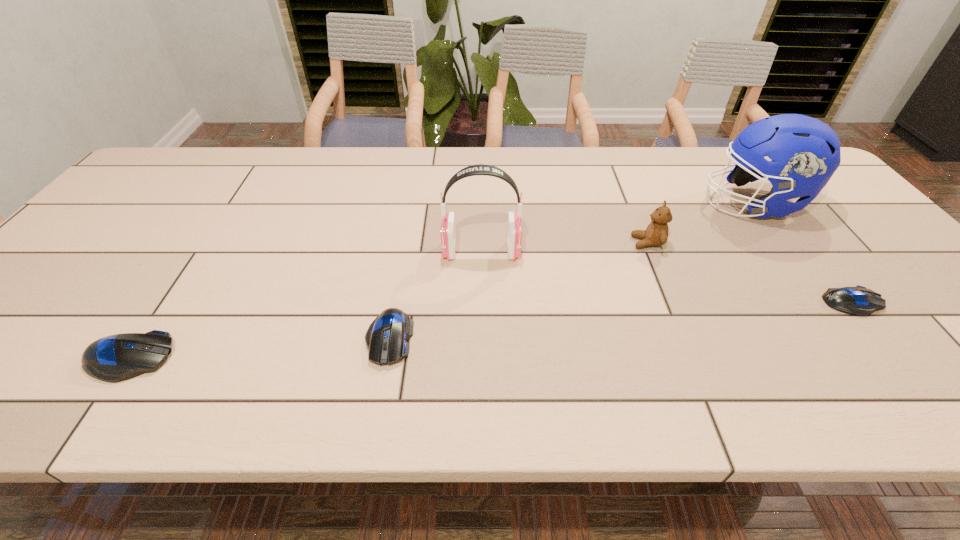
Identify which computer mouse is located as the nearest to the third object from left to right. Please provide its 2D coordinates. Your answer should be formatted as a tuple, i.e. [(x, y)], where the tuple contains the x and y coordinates of a point satisfying the conditions above.

[(386, 338)]

Find the location of a particular element. The width and height of the screenshot is (960, 540). vacant space that satisfies the following two spatial constraints: 1. on the outer surface of the fourth object from right to left; 2. on the button side of the second shortest object is located at coordinates (482, 338).

Locate an element on the screen. vacant position in the image that satisfies the following two spatial constraints: 1. on the button side of the rightmost computer mouse; 2. on the button side of the second computer mouse from right to left is located at coordinates (880, 338).